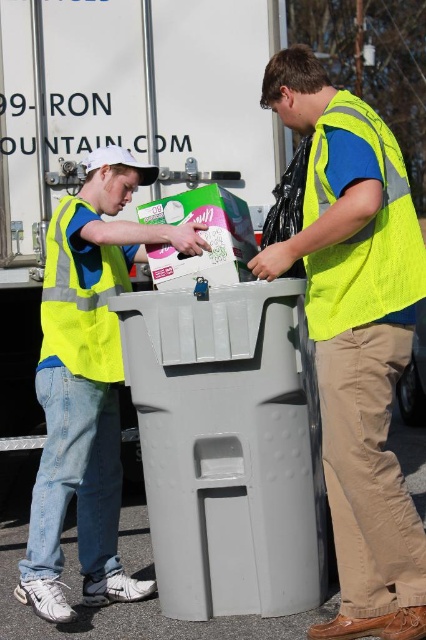
Question: Which is farther from the neon yellow mesh safety vest at right?

Choices:
 (A) high visibility yellow safety vest at left
 (B) neon yellow vest at center
 (C) neon yellow vest at left

Answer: (A)

Question: Does neon yellow mesh safety vest at right have a smaller size compared to high visibility yellow safety vest at left?

Choices:
 (A) yes
 (B) no

Answer: (B)

Question: Considering the real-world distances, which object is farthest from the neon yellow vest at center?

Choices:
 (A) neon yellow mesh safety vest at right
 (B) neon yellow vest at left
 (C) gray plastic recycling bin at center
 (D) high visibility yellow safety vest at left

Answer: (D)

Question: Does neon yellow mesh safety vest at right appear over high visibility yellow safety vest at left?

Choices:
 (A) no
 (B) yes

Answer: (B)

Question: Is gray plastic recycling bin at center positioned behind neon yellow mesh safety vest at right?

Choices:
 (A) no
 (B) yes

Answer: (B)

Question: Which point appears closest to the camera in this image?

Choices:
 (A) (233, 518)
 (B) (54, 586)
 (C) (420, 632)

Answer: (C)